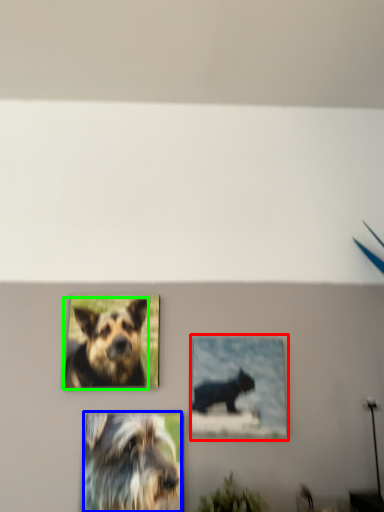
Question: Which is nearer to the picture frame (highlighted by a red box)? dog (highlighted by a blue box) or dog (highlighted by a green box).

Choices:
 (A) dog
 (B) dog

Answer: (A)